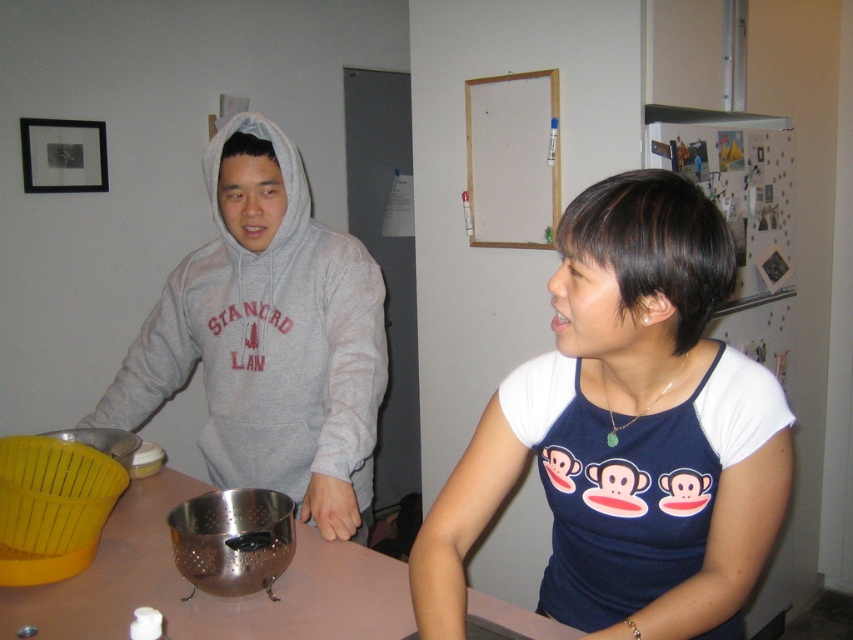
Question: Can you confirm if gray hoodie at left is wider than gray fleece hoodie at left?

Choices:
 (A) yes
 (B) no

Answer: (B)

Question: Considering the real-world distances, which object is farthest from the gray fleece hoodie at left?

Choices:
 (A) gray hoodie at left
 (B) metallic silver colander at center
 (C) blue fabric shirt at center

Answer: (A)

Question: Does blue fabric shirt at center appear on the right side of gray fleece hoodie at left?

Choices:
 (A) no
 (B) yes

Answer: (B)

Question: Which point appears farthest from the camera in this image?

Choices:
 (A) [x=508, y=484]
 (B) [x=285, y=412]
 (C) [x=790, y=426]

Answer: (C)

Question: Is blue fabric shirt at center above gray fleece hoodie at left?

Choices:
 (A) yes
 (B) no

Answer: (B)

Question: Among these objects, which one is nearest to the camera?

Choices:
 (A) gray fleece hoodie at left
 (B) metallic silver colander at center
 (C) blue fabric shirt at center

Answer: (C)